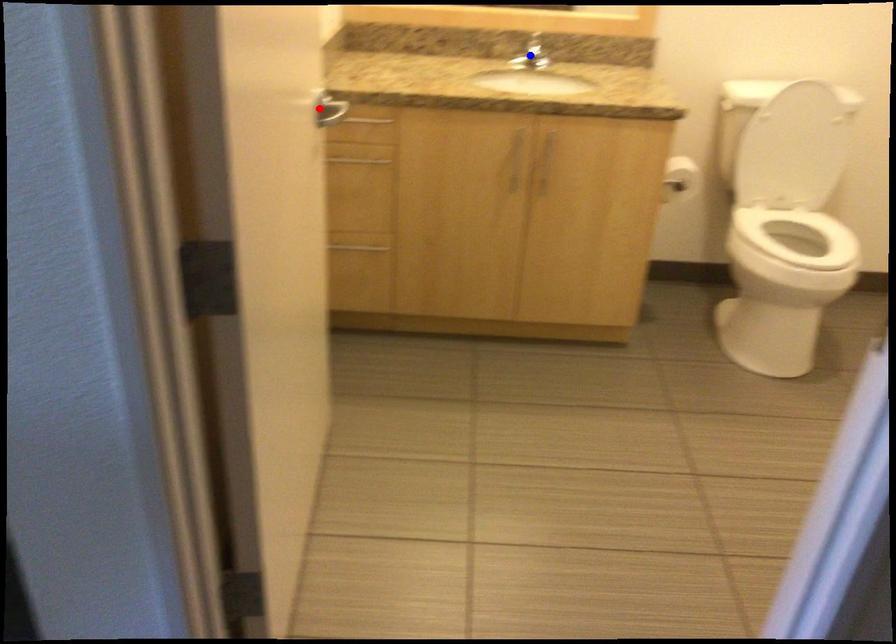
Question: In the image, two points are highlighted. Which point is nearer to the camera? Reply with the corresponding letter.

Choices:
 (A) blue point
 (B) red point

Answer: (B)